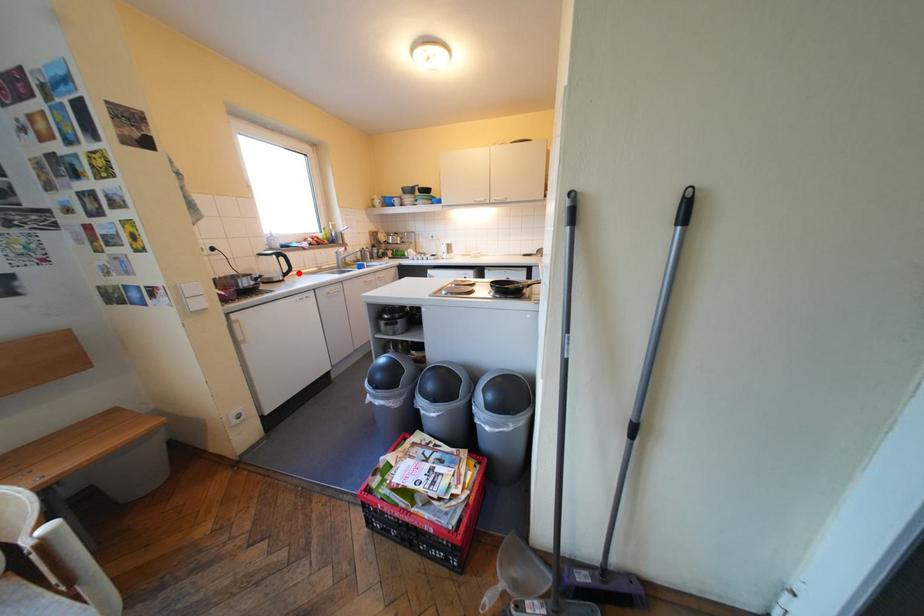
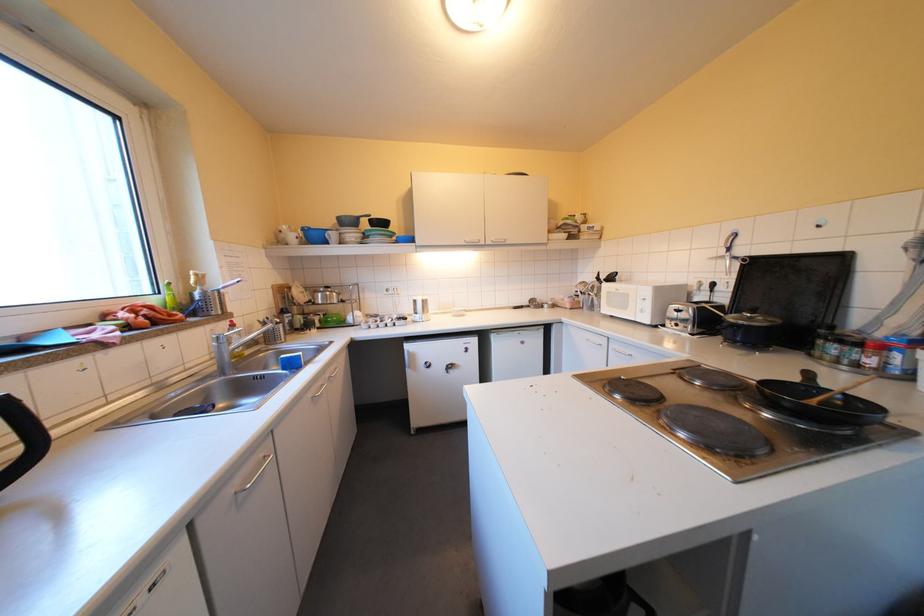
In the second image, find the point that corresponds to the highlighted location in the first image.

(17, 479)